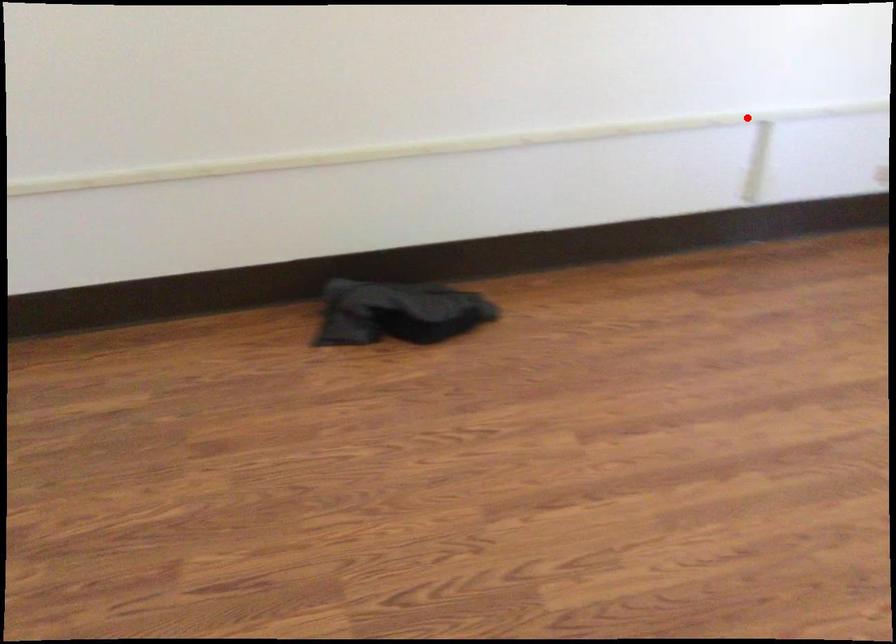
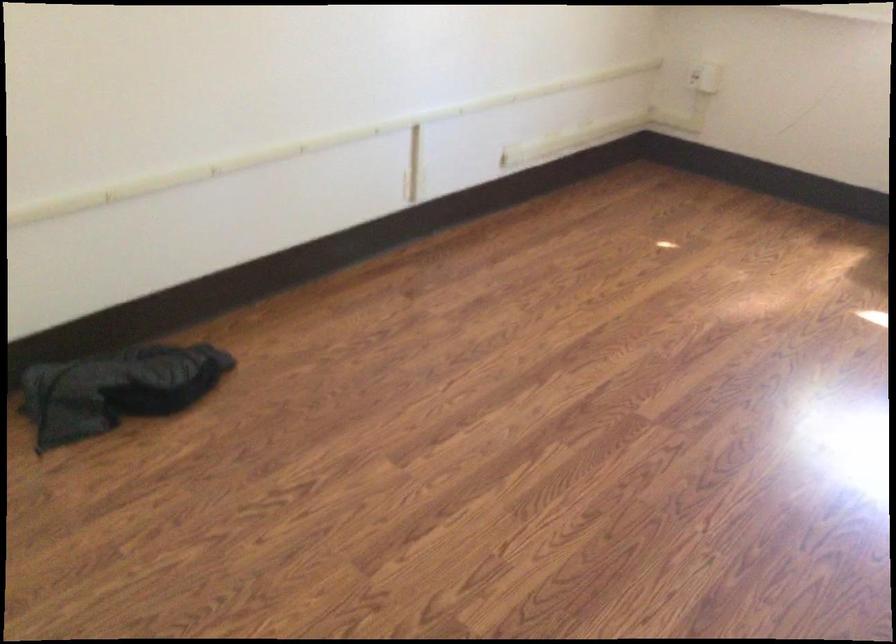
Question: I am providing you with two images of the same scene from different viewpoints. A red point is marked on the first image. At the location where the point appears in image 1, is it still visible in image 2?

Choices:
 (A) Yes
 (B) No

Answer: (A)